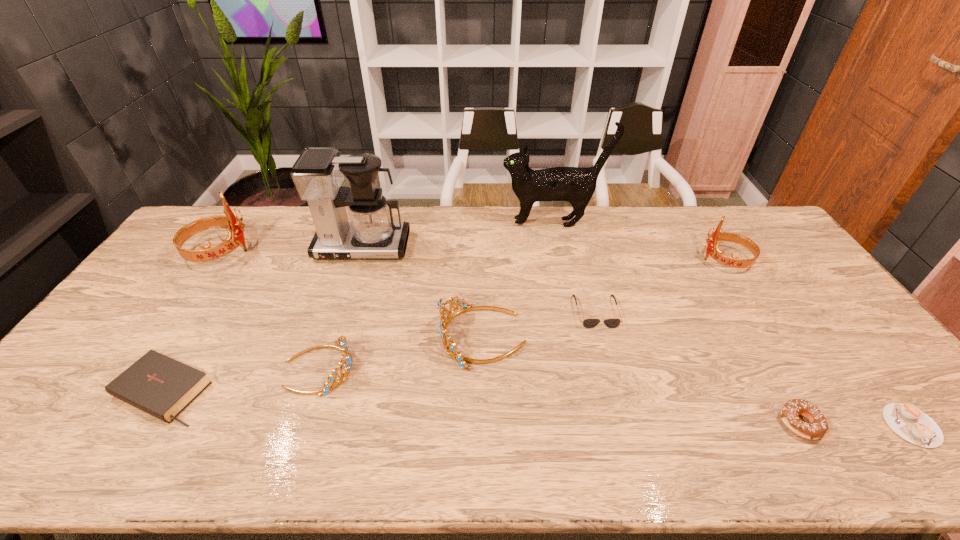
At what (x,y) coordinates should I click in order to perform the action: click on blank area located on the left of the Bible. Please return your answer as a coordinate pair (x, y). This screenshot has width=960, height=540. Looking at the image, I should click on (81, 391).

This screenshot has width=960, height=540. What are the coordinates of `free region located on the left of the shortest object` in the screenshot? It's located at (x=810, y=425).

In order to click on cat located at the far edge in this screenshot , I will do `click(576, 185)`.

This screenshot has height=540, width=960. I want to click on coffee maker that is at the far edge, so click(318, 173).

At what (x,y) coordinates should I click in order to perform the action: click on tiara positioned at the far edge. Please return your answer as a coordinate pair (x, y). This screenshot has height=540, width=960. Looking at the image, I should click on (235, 237).

This screenshot has width=960, height=540. Identify the location of doughnut at the near edge. (818, 426).

Where is `cappuccino at the near edge`? cappuccino at the near edge is located at coordinates (906, 420).

At what (x,y) coordinates should I click in order to perform the action: click on tiara that is at the left edge. Please return your answer as a coordinate pair (x, y). Looking at the image, I should click on (235, 237).

The width and height of the screenshot is (960, 540). What are the coordinates of `Bible at the left edge` in the screenshot? It's located at (163, 387).

At what (x,y) coordinates should I click in order to perform the action: click on tiara that is at the right edge. Please return your answer as a coordinate pair (x, y). The height and width of the screenshot is (540, 960). Looking at the image, I should click on (712, 249).